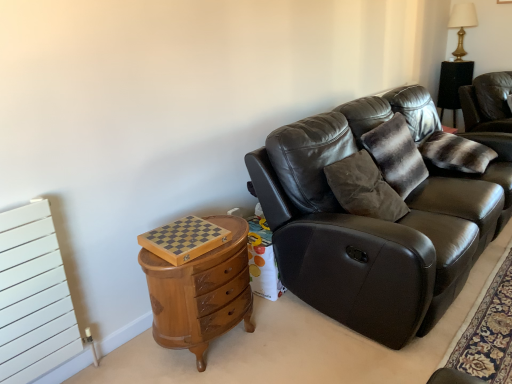
What are the coordinates of `vacant area that lies between matte black leather couch at center and wooden chest of drawers at left` in the screenshot? It's located at (297, 347).